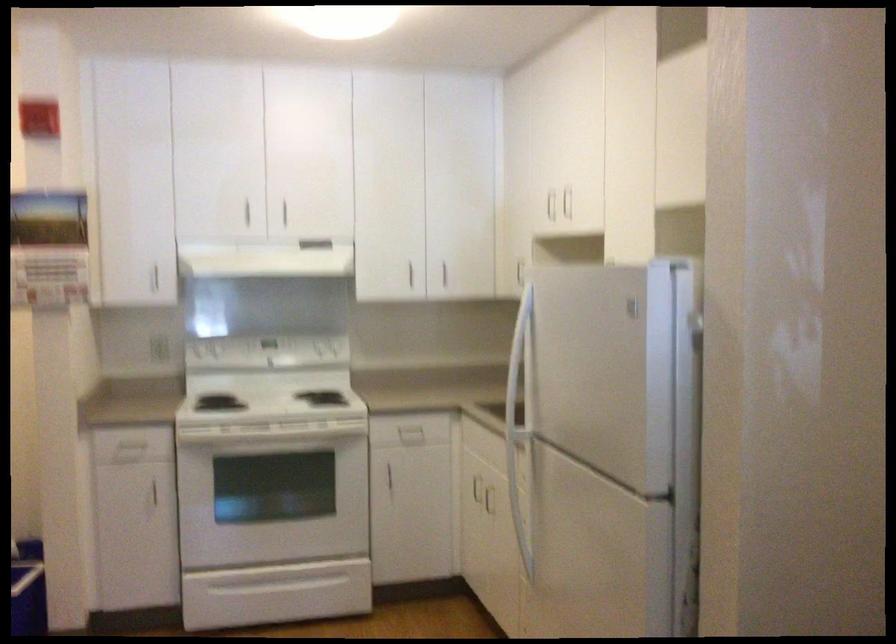
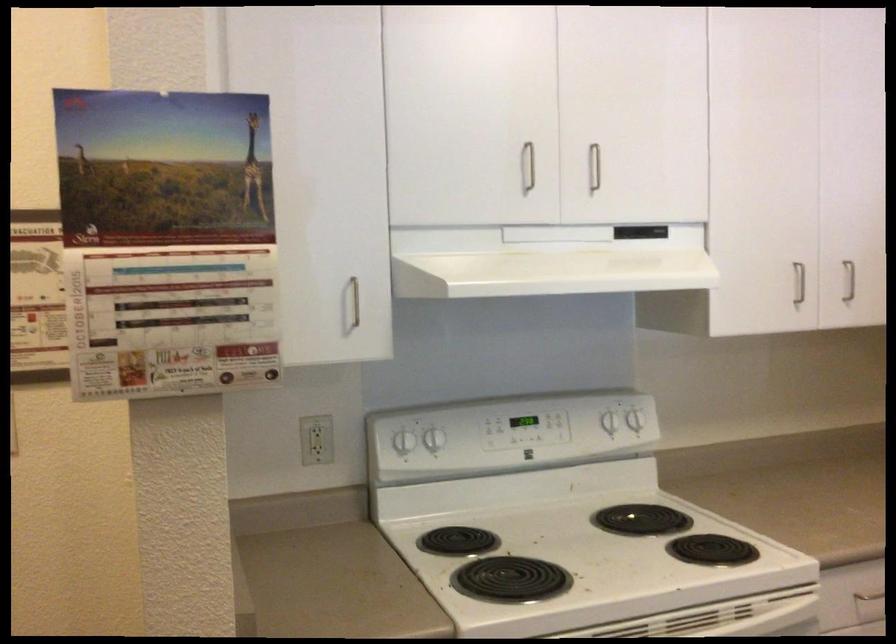
The point at (287, 209) is marked in the first image. Where is the corresponding point in the second image?

(593, 167)